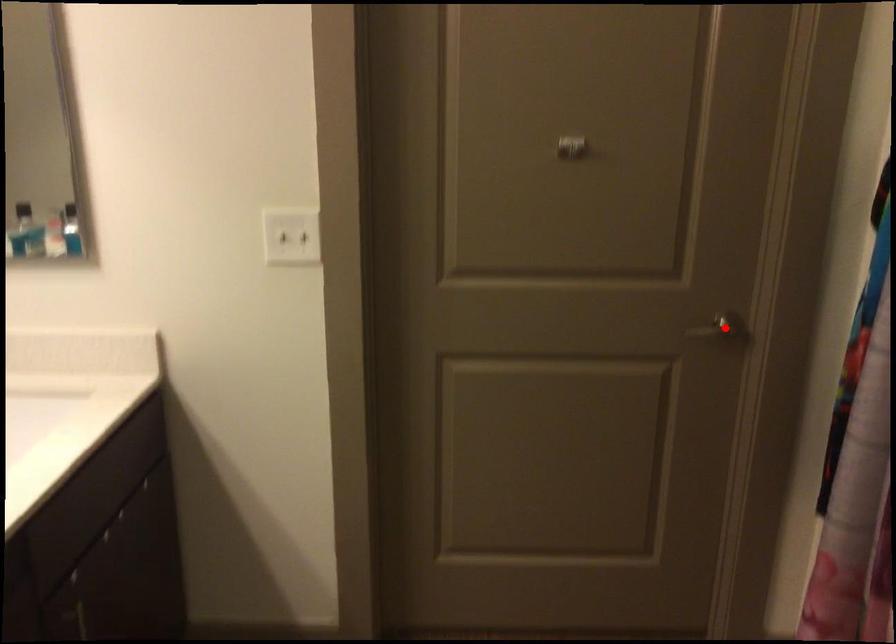
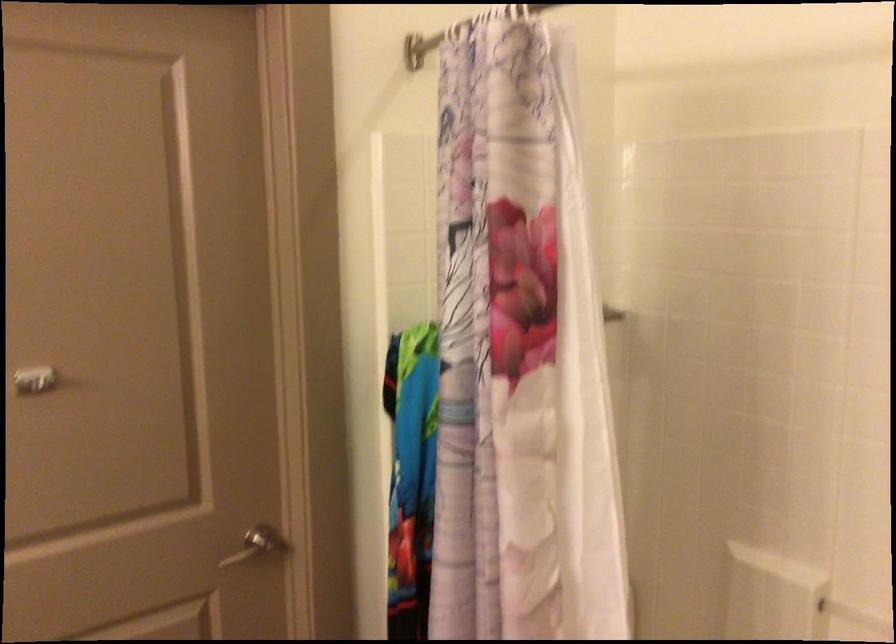
Question: A red point is marked in image1. In image2, is the corresponding 3D point closer to the camera or farther? Reply with the corresponding letter.

Choices:
 (A) The corresponding 3D point is closer.
 (B) The corresponding 3D point is farther.

Answer: (A)